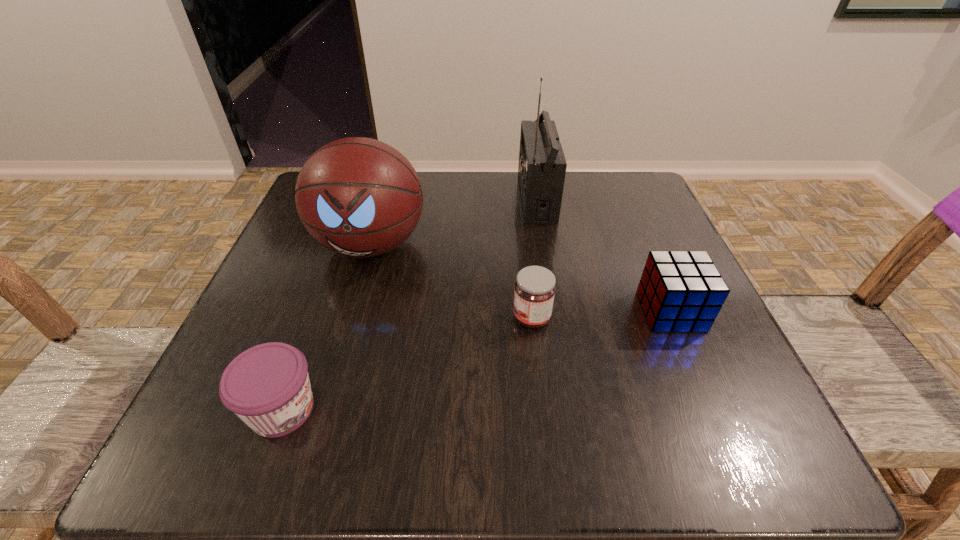
Locate an element on the screen. This screenshot has width=960, height=540. vacant position in the image that satisfies the following two spatial constraints: 1. on the front panel of the radio receiver; 2. on the front side of the right jam is located at coordinates (556, 318).

The width and height of the screenshot is (960, 540). I want to click on free location that satisfies the following two spatial constraints: 1. on the back side of the farther jam; 2. on the right side of the rightmost object, so click(x=531, y=311).